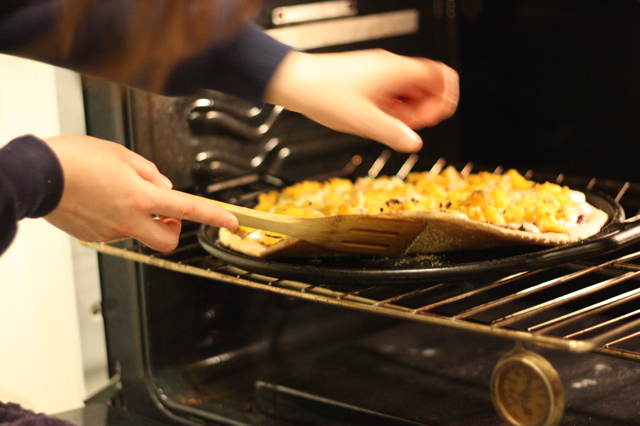
At what (x,y) coordinates should I click in order to perform the action: click on racks wire. Please return your answer as a coordinate pair (x, y). This screenshot has width=640, height=426. Looking at the image, I should click on (352, 306).